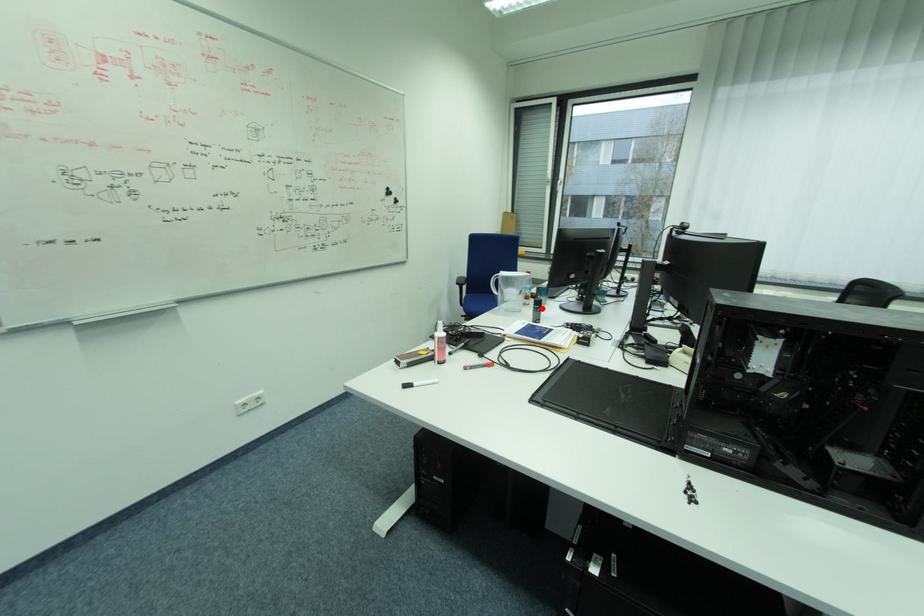
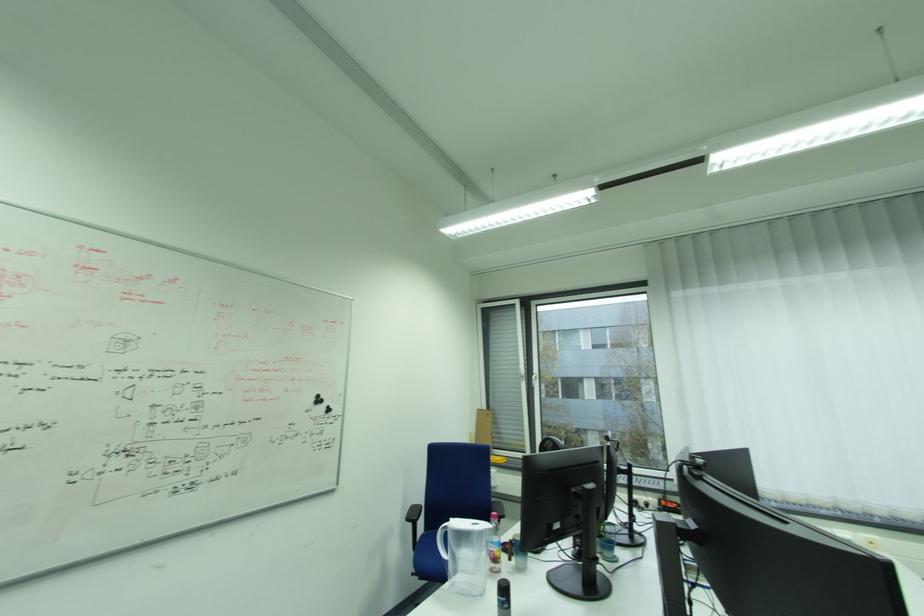
Question: I am providing you with two images of the same scene from different viewpoints. In image1, a red point is highlighted. Considering the same 3D point in image2, which of the following is correct?

Choices:
 (A) It is closer
 (B) It is farther

Answer: (B)